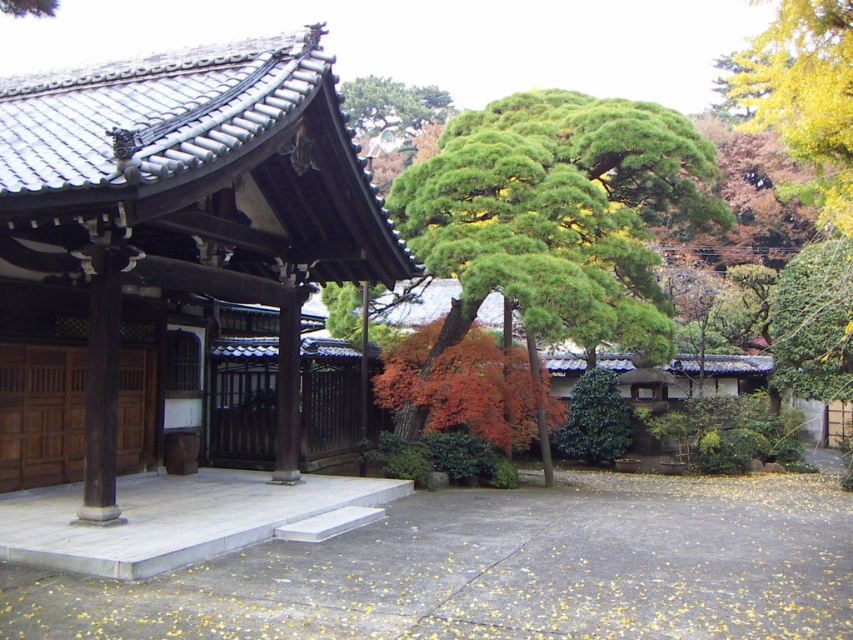
You are standing in the traditional Japanese garden and want to walk from one point to another. If you start at point (804, 45) and walk towards point (381, 93), will you be moving towards the building or away from it?

Since point (804, 45) is closer to the viewer than point (381, 93), walking from the first point to the second would mean moving away from the building.